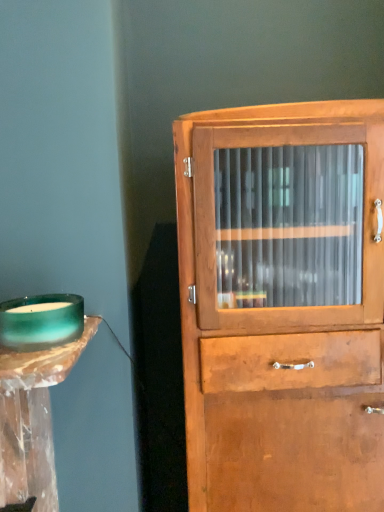
Question: Does wooden cabinet at center contain teal glass candle holder at left?

Choices:
 (A) yes
 (B) no

Answer: (B)

Question: Is wooden cabinet at center facing towards teal glass candle holder at left?

Choices:
 (A) no
 (B) yes

Answer: (A)

Question: Would you say wooden cabinet at center is a long distance from teal glass candle holder at left?

Choices:
 (A) no
 (B) yes

Answer: (A)

Question: Is wooden cabinet at center positioned in front of teal glass candle holder at left?

Choices:
 (A) yes
 (B) no

Answer: (B)

Question: Is the position of wooden cabinet at center more distant than that of teal glass candle holder at left?

Choices:
 (A) no
 (B) yes

Answer: (B)

Question: Can you confirm if wooden cabinet at center is taller than teal glass candle holder at left?

Choices:
 (A) yes
 (B) no

Answer: (A)

Question: Is teal glass candle holder at left shorter than wooden cabinet at center?

Choices:
 (A) yes
 (B) no

Answer: (A)

Question: Is teal glass candle holder at left positioned far away from wooden cabinet at center?

Choices:
 (A) no
 (B) yes

Answer: (A)

Question: From the image's perspective, does teal glass candle holder at left appear higher than wooden cabinet at center?

Choices:
 (A) yes
 (B) no

Answer: (A)

Question: Is teal glass candle holder at left oriented towards wooden cabinet at center?

Choices:
 (A) no
 (B) yes

Answer: (A)

Question: Is teal glass candle holder at left behind wooden cabinet at center?

Choices:
 (A) no
 (B) yes

Answer: (A)

Question: Can you see teal glass candle holder at left touching wooden cabinet at center?

Choices:
 (A) no
 (B) yes

Answer: (A)

Question: Considering the positions of teal glass candle holder at left and wooden cabinet at center in the image, is teal glass candle holder at left taller or shorter than wooden cabinet at center?

Choices:
 (A) short
 (B) tall

Answer: (A)